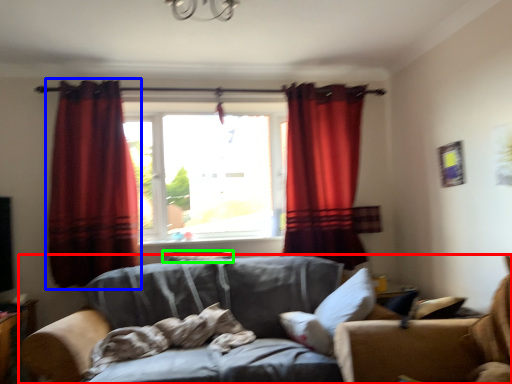
Question: Which object is the farthest from studio couch (highlighted by a red box)? Choose among these: curtain (highlighted by a blue box) or pillow (highlighted by a green box).

Choices:
 (A) curtain
 (B) pillow

Answer: (A)